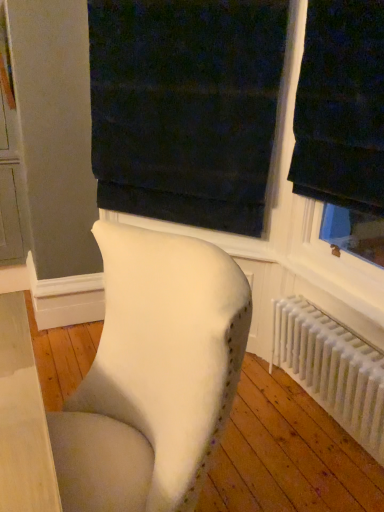
Question: Considering the relative sizes of white plastic radiator at lower right and white fabric chair at center in the image provided, is white plastic radiator at lower right bigger than white fabric chair at center?

Choices:
 (A) yes
 (B) no

Answer: (B)

Question: Is white plastic radiator at lower right to the left of white fabric chair at center from the viewer's perspective?

Choices:
 (A) yes
 (B) no

Answer: (B)

Question: From the image's perspective, is white plastic radiator at lower right located beneath white fabric chair at center?

Choices:
 (A) no
 (B) yes

Answer: (B)

Question: Is white plastic radiator at lower right facing away from white fabric chair at center?

Choices:
 (A) yes
 (B) no

Answer: (B)

Question: Is white plastic radiator at lower right thinner than white fabric chair at center?

Choices:
 (A) no
 (B) yes

Answer: (B)

Question: Is white plastic radiator at lower right to the right of white fabric chair at center from the viewer's perspective?

Choices:
 (A) yes
 (B) no

Answer: (A)

Question: Can you confirm if dark velvet curtain at upper center is shorter than white fabric chair at center?

Choices:
 (A) yes
 (B) no

Answer: (B)

Question: Is white fabric chair at center a part of dark velvet curtain at upper center?

Choices:
 (A) yes
 (B) no

Answer: (B)

Question: From a real-world perspective, is dark velvet curtain at upper center over white fabric chair at center?

Choices:
 (A) yes
 (B) no

Answer: (A)

Question: Is the depth of dark velvet curtain at upper center greater than that of white fabric chair at center?

Choices:
 (A) no
 (B) yes

Answer: (B)

Question: Can you confirm if dark velvet curtain at upper center is positioned to the left of white fabric chair at center?

Choices:
 (A) yes
 (B) no

Answer: (B)

Question: Does dark velvet curtain at upper center have a greater height compared to white fabric chair at center?

Choices:
 (A) no
 (B) yes

Answer: (B)

Question: Is dark velvet curtain at upper center smaller than white plastic radiator at lower right?

Choices:
 (A) no
 (B) yes

Answer: (A)